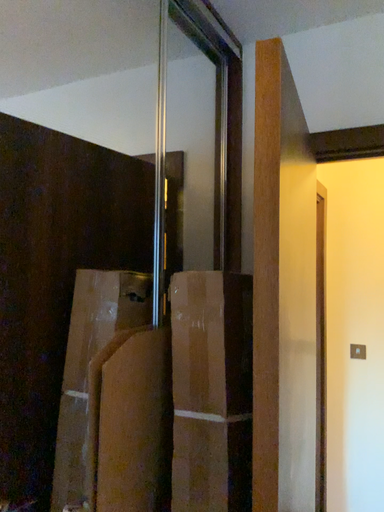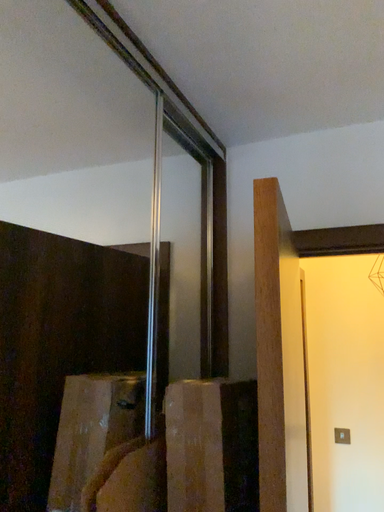
Question: How did the camera likely rotate when shooting the video?

Choices:
 (A) rotated upward
 (B) rotated downward

Answer: (A)